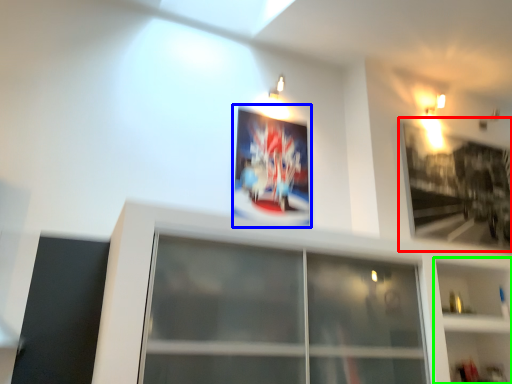
Question: Which is nearer to the picture frame (highlighted by a red box)? picture frame (highlighted by a blue box) or shelf (highlighted by a green box).

Choices:
 (A) picture frame
 (B) shelf

Answer: (B)